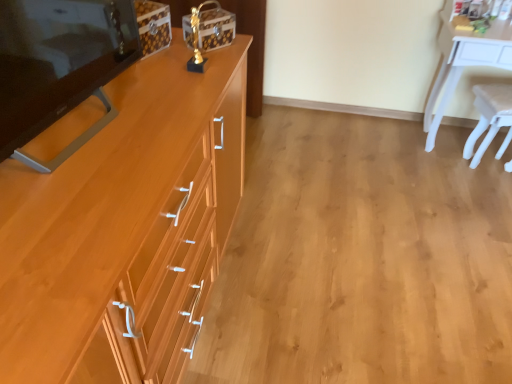
Locate an element on the screen. This screenshot has height=384, width=512. space that is in front of white plastic chair at right is located at coordinates (488, 196).